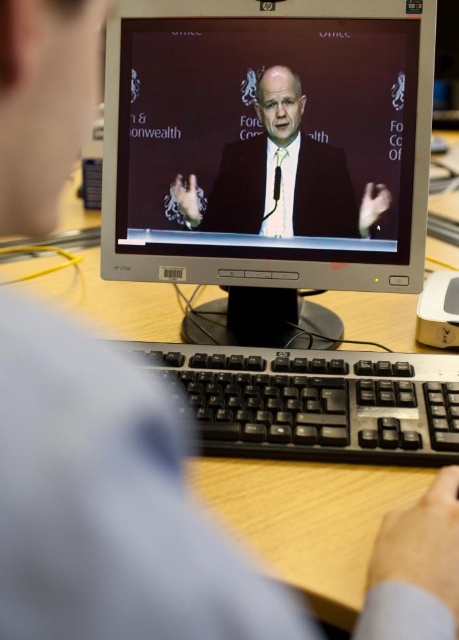
Question: Is black plastic keyboard at center behind satin black suit at center?

Choices:
 (A) yes
 (B) no

Answer: (B)

Question: Does white plastic monitor at center appear over satin black suit at center?

Choices:
 (A) no
 (B) yes

Answer: (A)

Question: Considering the real-world distances, which object is closest to the satin black suit at center?

Choices:
 (A) white plastic monitor at center
 (B) black plastic keyboard at center

Answer: (A)

Question: Based on their relative distances, which object is nearer to the satin black suit at center?

Choices:
 (A) white plastic monitor at center
 (B) black plastic keyboard at center

Answer: (A)

Question: From the image, what is the correct spatial relationship of black plastic keyboard at center in relation to satin black suit at center?

Choices:
 (A) left
 (B) right

Answer: (A)

Question: Which object is positioned closest to the white plastic monitor at center?

Choices:
 (A) satin black suit at center
 (B) black plastic keyboard at center

Answer: (A)